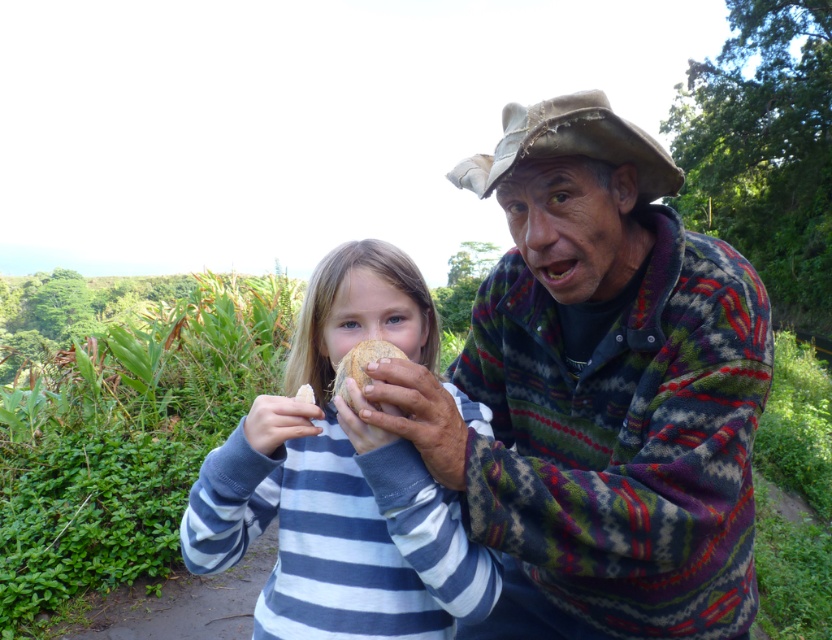
Question: Which point is farther from the camera taking this photo?

Choices:
 (A) (686, 458)
 (B) (360, 368)
 (C) (380, 248)

Answer: (C)

Question: Can you confirm if multicolored knitted sweater at center is wider than brown matte coconut at center?

Choices:
 (A) no
 (B) yes

Answer: (B)

Question: Which object is farther from the camera taking this photo?

Choices:
 (A) multicolored knitted sweater at center
 (B) brown matte coconut at center
 (C) blue striped sweater at center

Answer: (C)

Question: Does multicolored knitted sweater at center have a smaller size compared to blue striped sweater at center?

Choices:
 (A) yes
 (B) no

Answer: (B)

Question: Among these objects, which one is farthest from the camera?

Choices:
 (A) blue striped sweater at center
 (B) brown matte coconut at center

Answer: (A)

Question: Does multicolored knitted sweater at center have a larger size compared to brown matte coconut at center?

Choices:
 (A) yes
 (B) no

Answer: (A)